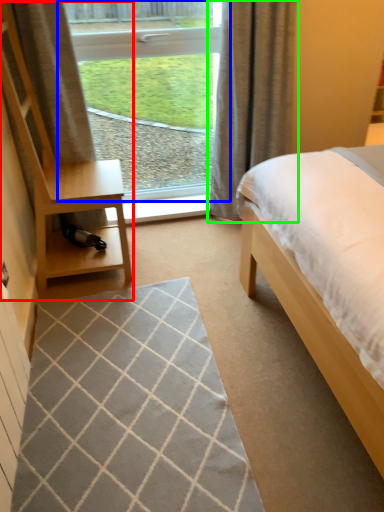
Question: Considering the real-world distances, which object is closest to dresser (highlighted by a red box)? window (highlighted by a blue box) or curtain (highlighted by a green box).

Choices:
 (A) window
 (B) curtain

Answer: (B)